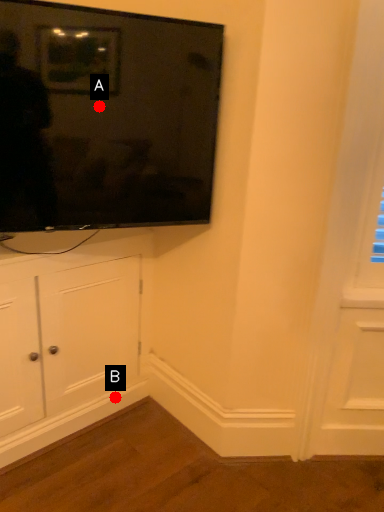
Question: Two points are circled on the image, labeled by A and B beside each circle. Which point appears farthest from the camera in this image?

Choices:
 (A) A is further
 (B) B is further

Answer: (B)